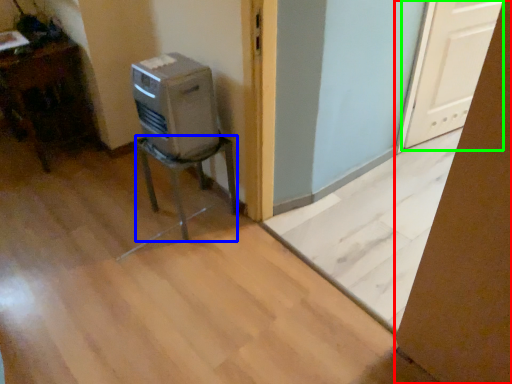
Question: Estimate the real-world distances between objects in this image. Which object is closer to cardboard box (highlighted by a red box), furniture (highlighted by a blue box) or screen door (highlighted by a green box)?

Choices:
 (A) furniture
 (B) screen door

Answer: (A)